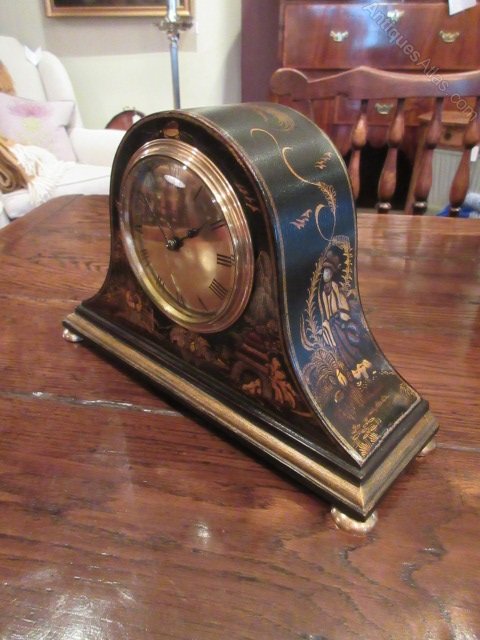
I want to click on the left armrest, so click(x=102, y=143).